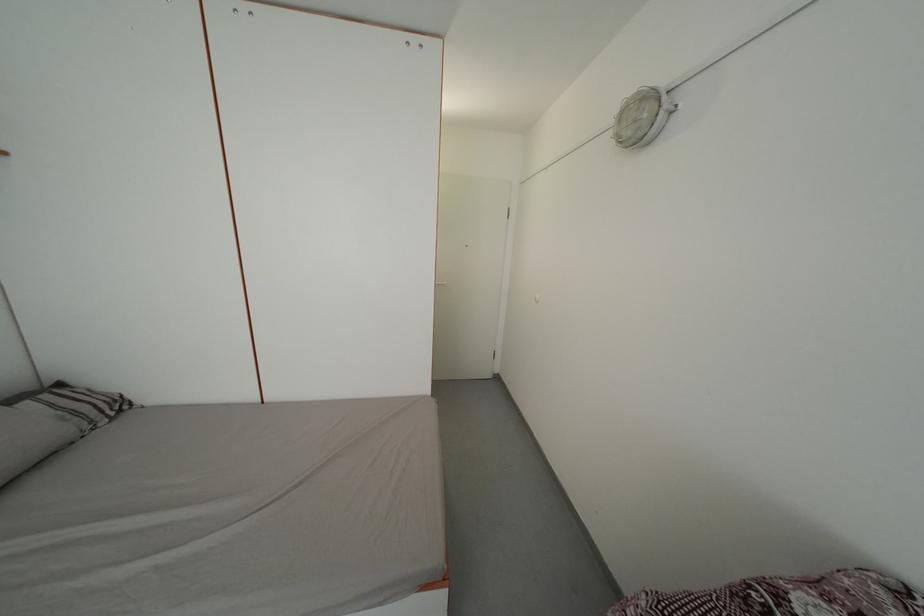
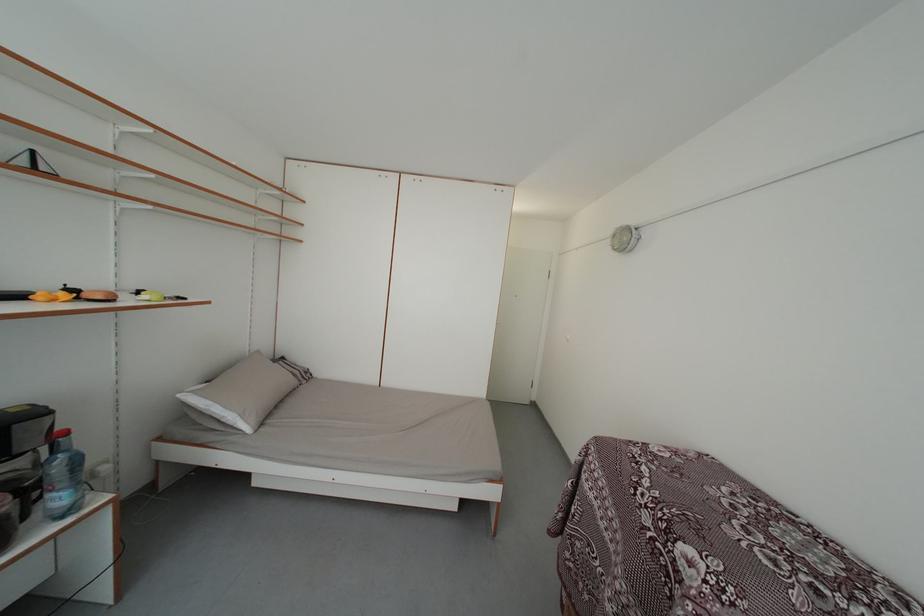
In the second image, find the point that corresponds to [649,128] in the first image.

(631, 246)